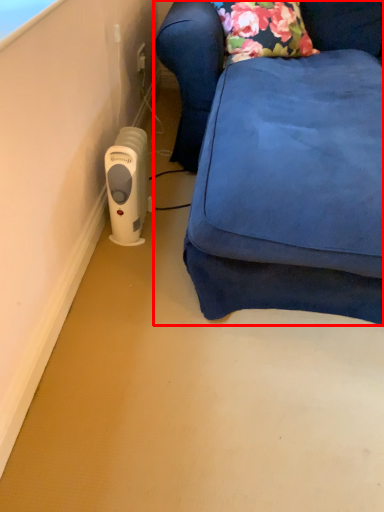
Question: From the image's perspective, what is the correct spatial relationship of furniture (annotated by the red box) in relation to home appliance?

Choices:
 (A) below
 (B) above

Answer: (B)